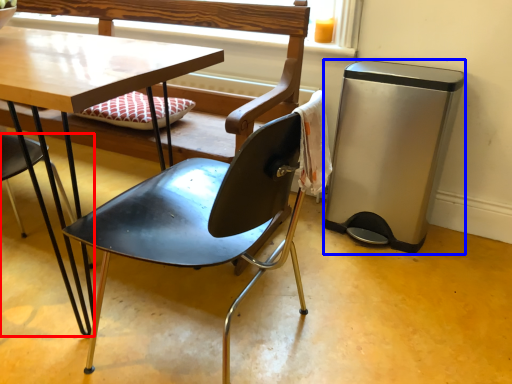
Question: Among these objects, which one is farthest to the camera, chair (highlighted by a red box) or trash bin/can (highlighted by a blue box)?

Choices:
 (A) chair
 (B) trash bin/can

Answer: (B)